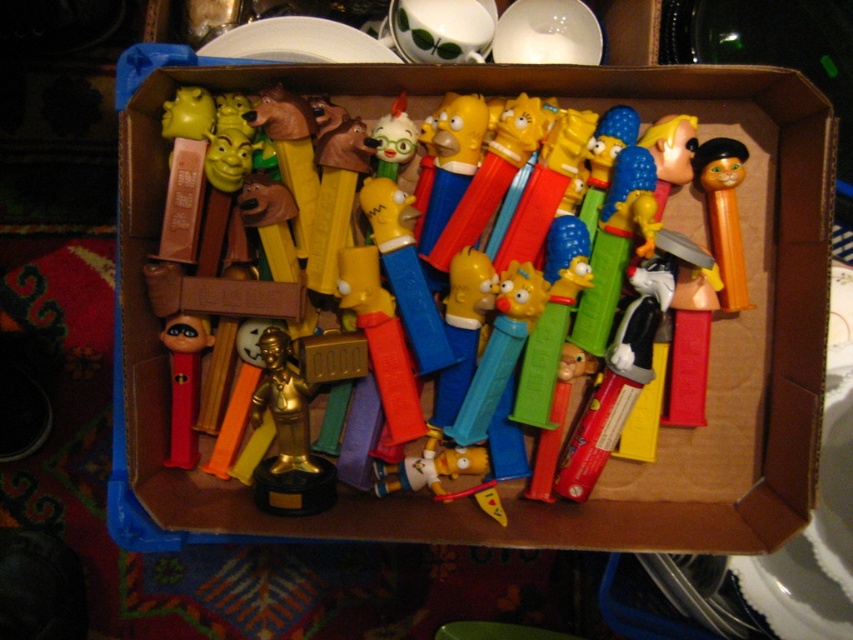
Looking at this image, between multicolored plastic toys at center and orange matte cat at right, which one is positioned higher?

orange matte cat at right is above.

What are the coordinates of `multicolored plastic toys at center` in the screenshot? It's located at (613, 460).

You are a GUI agent. You are given a task and a screenshot of the screen. Output one action in this format:
    pyautogui.click(x=<x>, y=<y>)
    Task: Click on the multicolored plastic toys at center
    
    Given the screenshot: What is the action you would take?
    pyautogui.click(x=613, y=460)

Is multicolored plastic toys at center shorter than red plastic pez dispenser at center?

No, multicolored plastic toys at center is not shorter than red plastic pez dispenser at center.

Looking at this image, between multicolored plastic toys at center and red plastic pez dispenser at center, which one is positioned higher?

multicolored plastic toys at center is higher up.

Where is `multicolored plastic toys at center`? The image size is (853, 640). multicolored plastic toys at center is located at coordinates (613, 460).

Is the position of orange matte cat at right less distant than that of red plastic pez dispenser at center?

Yes, it is in front of red plastic pez dispenser at center.

Looking at this image, which is above, orange matte cat at right or red plastic pez dispenser at center?

Positioned higher is orange matte cat at right.

Does point (709, 209) come in front of point (178, 365)?

No, (709, 209) is behind (178, 365).

Image resolution: width=853 pixels, height=640 pixels. Identify the location of orange matte cat at right. (724, 214).